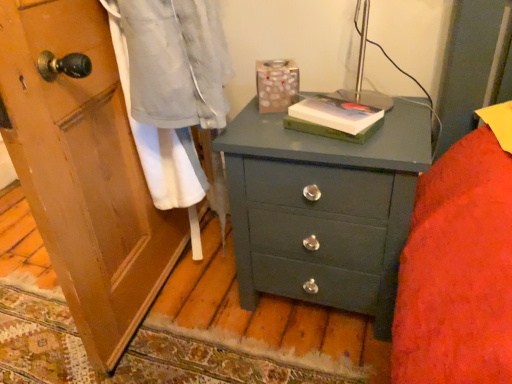
Question: Is hardcover book at center, marked as the second book in a top-to-bottom arrangement, at the right side of matte green chest of drawers at center?

Choices:
 (A) no
 (B) yes

Answer: (A)

Question: Considering the relative sizes of hardcover book at center, marked as the 1th book in a bottom-to-top arrangement, and matte green chest of drawers at center in the image provided, is hardcover book at center, marked as the 1th book in a bottom-to-top arrangement, bigger than matte green chest of drawers at center?

Choices:
 (A) no
 (B) yes

Answer: (A)

Question: Is hardcover book at center, marked as the second book in a top-to-bottom arrangement, shorter than matte green chest of drawers at center?

Choices:
 (A) no
 (B) yes

Answer: (B)

Question: Is hardcover book at center, marked as the second book in a top-to-bottom arrangement, surrounding matte green chest of drawers at center?

Choices:
 (A) no
 (B) yes

Answer: (A)

Question: From a real-world perspective, is hardcover book at center, marked as the second book in a top-to-bottom arrangement, on top of matte green chest of drawers at center?

Choices:
 (A) no
 (B) yes

Answer: (B)

Question: From the image's perspective, is hardcover book at center, marked as the 1th book in a bottom-to-top arrangement, on top of matte green chest of drawers at center?

Choices:
 (A) no
 (B) yes

Answer: (B)

Question: Is matte green chest of drawers at center not within hardcover book at center, which is the 2th book from bottom to top?

Choices:
 (A) no
 (B) yes

Answer: (B)

Question: Considering the relative sizes of matte green chest of drawers at center and hardcover book at center, which is the 2th book from bottom to top, in the image provided, is matte green chest of drawers at center taller than hardcover book at center, which is the 2th book from bottom to top,?

Choices:
 (A) no
 (B) yes

Answer: (B)

Question: Can you confirm if matte green chest of drawers at center is shorter than hardcover book at center, which is the 2th book from bottom to top?

Choices:
 (A) no
 (B) yes

Answer: (A)

Question: Is the position of matte green chest of drawers at center less distant than that of hardcover book at center, acting as the 1th book starting from the top?

Choices:
 (A) yes
 (B) no

Answer: (A)

Question: From the image's perspective, is matte green chest of drawers at center on top of hardcover book at center, acting as the 1th book starting from the top?

Choices:
 (A) yes
 (B) no

Answer: (B)

Question: Considering the relative sizes of matte green chest of drawers at center and hardcover book at center, which is the 2th book from bottom to top, in the image provided, is matte green chest of drawers at center smaller than hardcover book at center, which is the 2th book from bottom to top,?

Choices:
 (A) yes
 (B) no

Answer: (B)

Question: From a real-world perspective, is hardcover book at center, acting as the 1th book starting from the top, under hardcover book at center, marked as the second book in a top-to-bottom arrangement?

Choices:
 (A) no
 (B) yes

Answer: (A)